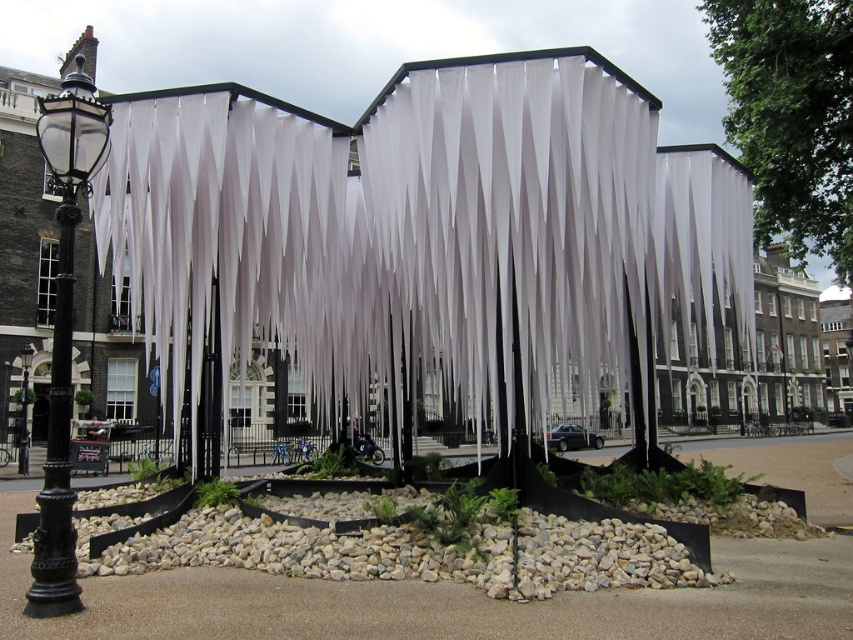
You are standing at the entrance of the plaza and want to find the white fabric curtain at center. According to the coordinates provided, where should you look relative to your current position?

The white fabric curtain at center is located at coordinates point (418, 220), which means it is positioned slightly to the right and forward from your current position at the entrance.

You are an artist planning to hang a new sculpture between the white fabric curtain at center and the black glass lamp post at left. Which object should you choose as the anchor point if you want the sculpture to be positioned higher than both?

The black glass lamp post at left is taller than the white fabric curtain at center, so you should anchor the sculpture to the black glass lamp post at left to position it higher than both.